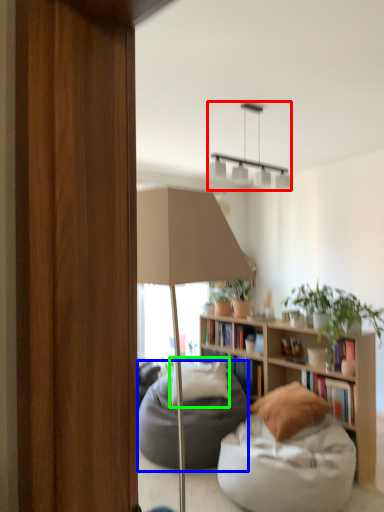
Question: Estimate the real-world distances between objects in this image. Which object is farther from lamp (highlighted by a red box), bean bag chair (highlighted by a blue box) or pillow (highlighted by a green box)?

Choices:
 (A) bean bag chair
 (B) pillow

Answer: (A)